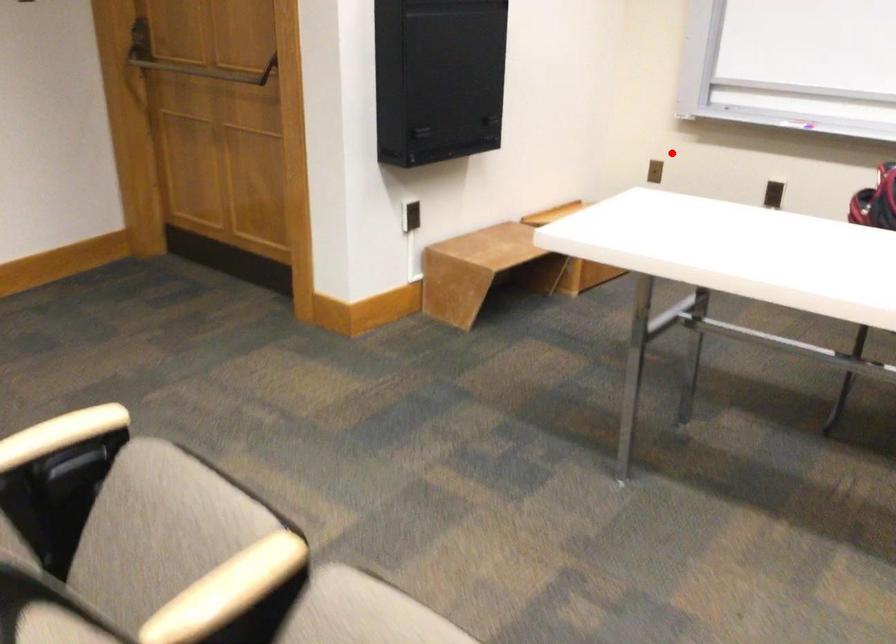
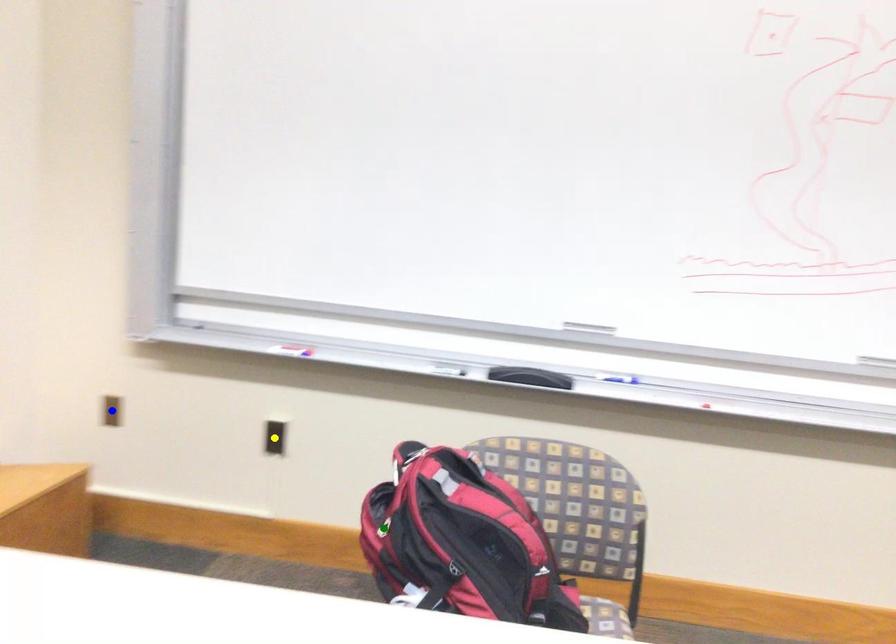
Question: I am providing you with two images of the same scene from different viewpoints. A red point is marked on the first image. You are given multiple points on the second image. Which spot in image 2 lines up with the point in image 1?

Choices:
 (A) yellow point
 (B) blue point
 (C) green point

Answer: (B)